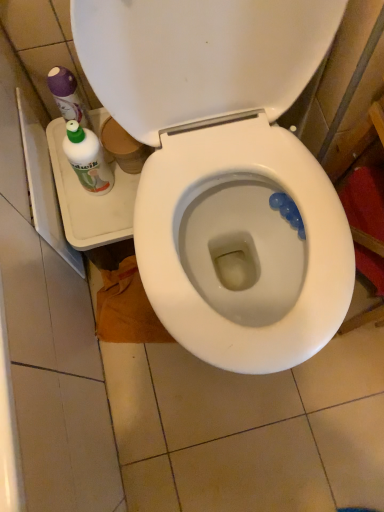
I want to click on vacant region in front of white glossy bottle at left, so click(97, 223).